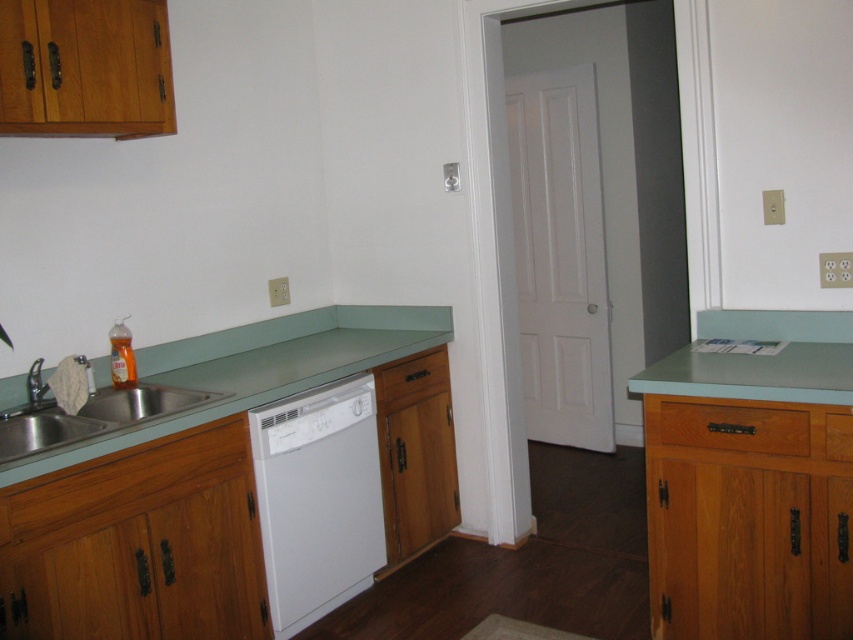
You are trying to install a new kitchen gadget that requires a minimum of 10 inches of space between the stainless steel sink at lower left and the brushed metal faucet at sink left. Based on the image, will there be enough space for the gadget?

The stainless steel sink at lower left and the brushed metal faucet at sink left are 8.89 inches apart, which is less than the required 10 inches. Therefore, there is not enough space for the gadget.

You are standing in the kitchen and want to place an object at the point closer to you between the two points marked as point (177, 396) and point (45, 388). According to the scene description, which point should you choose?

Point (177, 396) is further to the viewer than point (45, 388), so you should choose point (177, 396) as it is closer to you.

You are trying to determine if you can place a tall glass on the counter next to the stainless steel sink at lower left without it touching the brushed metal faucet at sink left. Based on their heights, can the glass be placed there?

The stainless steel sink at lower left is taller than the brushed metal faucet at sink left. Since the faucet is shorter, placing the glass next to the sink should not interfere with the faucet in terms of height.